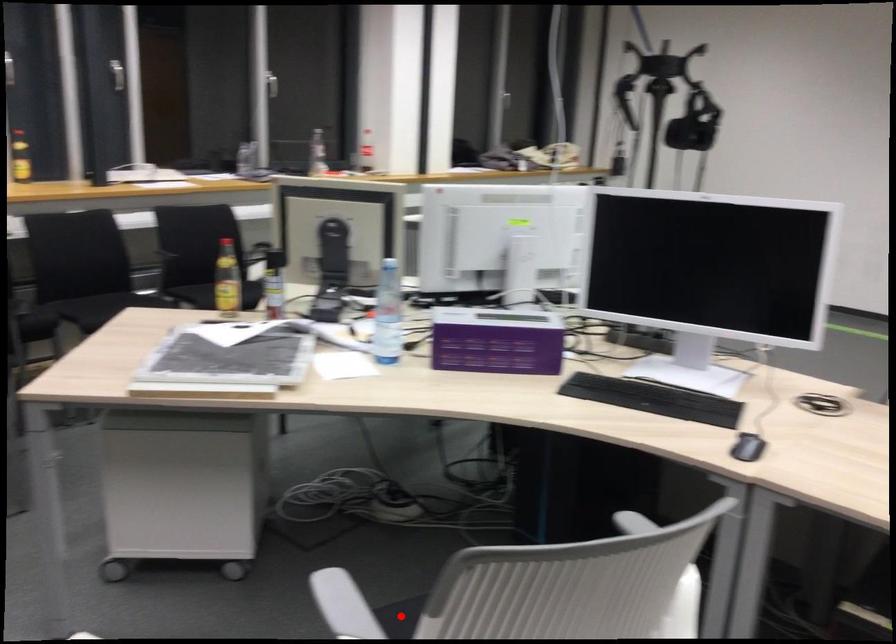
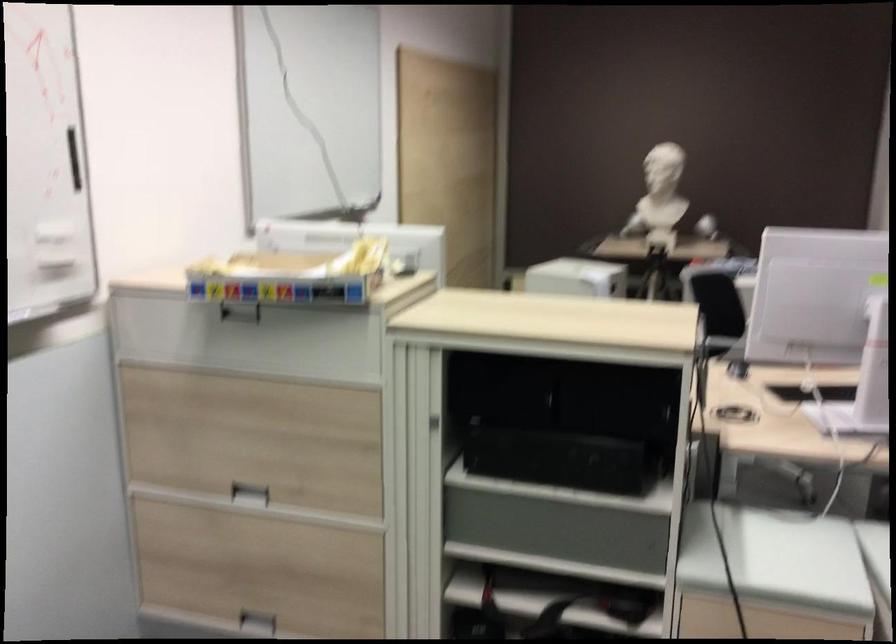
Question: I am providing you with two images of the same scene from different viewpoints. A red point is marked on the first image. Is the red point's position out of view in image 2?

Choices:
 (A) Yes
 (B) No

Answer: (A)